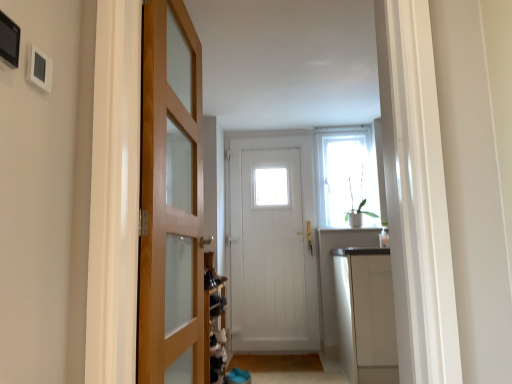
Question: Is the surface of brown wooden mat at lower center, the 2th path viewed from the front, in direct contact with brown carpet at lower center, acting as the 2th path starting from the back?

Choices:
 (A) yes
 (B) no

Answer: (A)

Question: Can you confirm if brown wooden mat at lower center, positioned as the first path in back-to-front order, is smaller than brown carpet at lower center, acting as the 2th path starting from the back?

Choices:
 (A) no
 (B) yes

Answer: (B)

Question: Is brown carpet at lower center, which is the 1th path from front to back, surrounded by brown wooden mat at lower center, positioned as the first path in back-to-front order?

Choices:
 (A) no
 (B) yes

Answer: (A)

Question: Does brown wooden mat at lower center, the 2th path viewed from the front, have a greater width compared to brown carpet at lower center, which is the 1th path from front to back?

Choices:
 (A) yes
 (B) no

Answer: (B)

Question: Is brown wooden mat at lower center, positioned as the first path in back-to-front order, far from brown carpet at lower center, which is the 1th path from front to back?

Choices:
 (A) no
 (B) yes

Answer: (A)

Question: Is white wooden door at center, marked as the 1th door in a right-to-left arrangement, taller or shorter than brown carpet at lower center, acting as the 2th path starting from the back?

Choices:
 (A) short
 (B) tall

Answer: (B)

Question: Looking at their shapes, would you say white wooden door at center, marked as the 1th door in a right-to-left arrangement, is wider or thinner than brown carpet at lower center, acting as the 2th path starting from the back?

Choices:
 (A) thin
 (B) wide

Answer: (A)

Question: In terms of size, does white wooden door at center, which appears as the first door when viewed from the back, appear bigger or smaller than brown carpet at lower center, which is the 1th path from front to back?

Choices:
 (A) small
 (B) big

Answer: (B)

Question: From a real-world perspective, is white wooden door at center, which appears as the first door when viewed from the back, physically located above or below brown carpet at lower center, which is the 1th path from front to back?

Choices:
 (A) below
 (B) above

Answer: (B)

Question: Is brown wooden mat at lower center, positioned as the first path in back-to-front order, in front of or behind wooden door at left, which appears as the first door when viewed from the left, in the image?

Choices:
 (A) front
 (B) behind

Answer: (B)

Question: Considering the positions of brown wooden mat at lower center, positioned as the first path in back-to-front order, and wooden door at left, the first door when ordered from front to back, in the image, is brown wooden mat at lower center, positioned as the first path in back-to-front order, wider or thinner than wooden door at left, the first door when ordered from front to back,?

Choices:
 (A) thin
 (B) wide

Answer: (B)

Question: Is point (276, 362) positioned closer to the camera than point (163, 140)?

Choices:
 (A) closer
 (B) farther

Answer: (B)

Question: Considering the positions of brown wooden mat at lower center, the 2th path viewed from the front, and wooden door at left, the first door when ordered from front to back, in the image, is brown wooden mat at lower center, the 2th path viewed from the front, taller or shorter than wooden door at left, the first door when ordered from front to back,?

Choices:
 (A) tall
 (B) short

Answer: (B)

Question: From a real-world perspective, relative to brown carpet at lower center, which is the 1th path from front to back, is green matte plant at upper right vertically above or below?

Choices:
 (A) below
 (B) above

Answer: (B)

Question: In terms of size, does green matte plant at upper right appear bigger or smaller than brown carpet at lower center, acting as the 2th path starting from the back?

Choices:
 (A) big
 (B) small

Answer: (A)